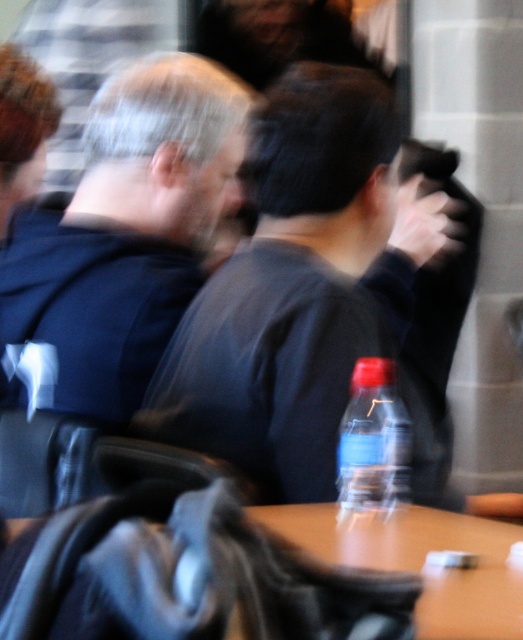
Question: Considering the relative positions of dark gray sweater at center and dark blue fabric at left in the image provided, where is dark gray sweater at center located with respect to dark blue fabric at left?

Choices:
 (A) left
 (B) right

Answer: (B)

Question: Can you confirm if dark gray sweater at center is positioned above translucent plastic bottle at center?

Choices:
 (A) yes
 (B) no

Answer: (A)

Question: Which object is farther from the camera taking this photo?

Choices:
 (A) translucent plastic bottle at center
 (B) wooden table at center
 (C) dark blue fabric at left
 (D) dark gray sweater at center

Answer: (C)

Question: Can you confirm if dark gray sweater at center is positioned above dark blue fabric at left?

Choices:
 (A) no
 (B) yes

Answer: (A)

Question: Which object is positioned farthest from the dark blue fabric at left?

Choices:
 (A) translucent plastic bottle at center
 (B) wooden table at center
 (C) dark gray sweater at center

Answer: (B)

Question: Among these points, which one is nearest to the camera?

Choices:
 (A) (389, 372)
 (B) (491, 547)
 (C) (281, 291)
 (D) (62, 344)

Answer: (B)